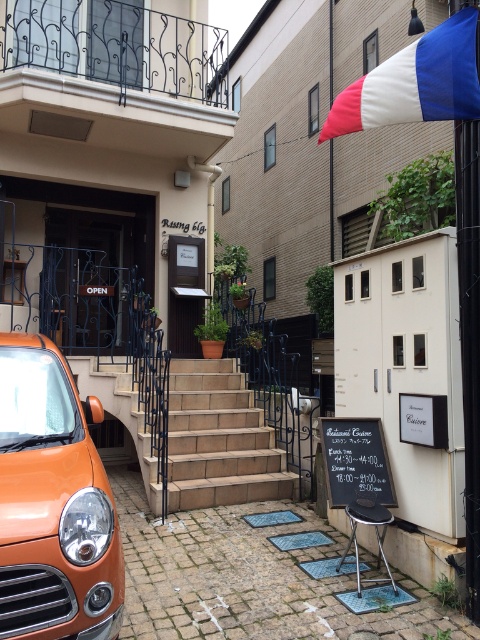
You are a customer standing at the entrance of the restaurant. You notice the tricolor fabric flag at upper right and the black chalkboard at center. Which object is wider?

The tricolor fabric flag at upper right is wider than the black chalkboard at center.

You are a delivery person standing at the base of the beige stone stairs at center. You need to deliver a package to the tricolor fabric flag at upper right, which is displayed on the building. Can you reach it by walking up the stairs?

The beige stone stairs at center is 3.79 meters away from the tricolor fabric flag at upper right. Since the stairs lead up to the entrance and the flag is on the building, you can reach the flag by walking up the stairs as they are in close proximity.